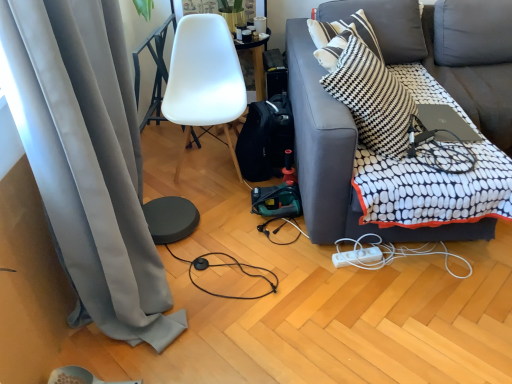
The width and height of the screenshot is (512, 384). In order to click on unoccupied region to the right of white plastic power strip at lower right in this screenshot , I will do `click(475, 275)`.